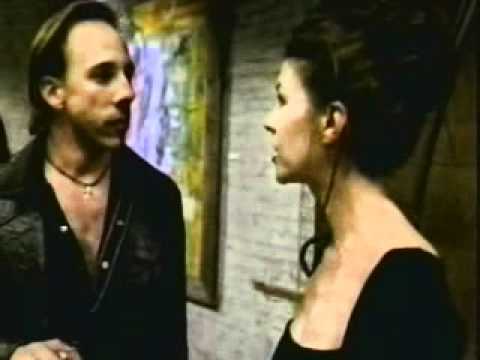
Locate an element on the screen. The width and height of the screenshot is (480, 360). brown brick wall is located at coordinates pos(252,131).